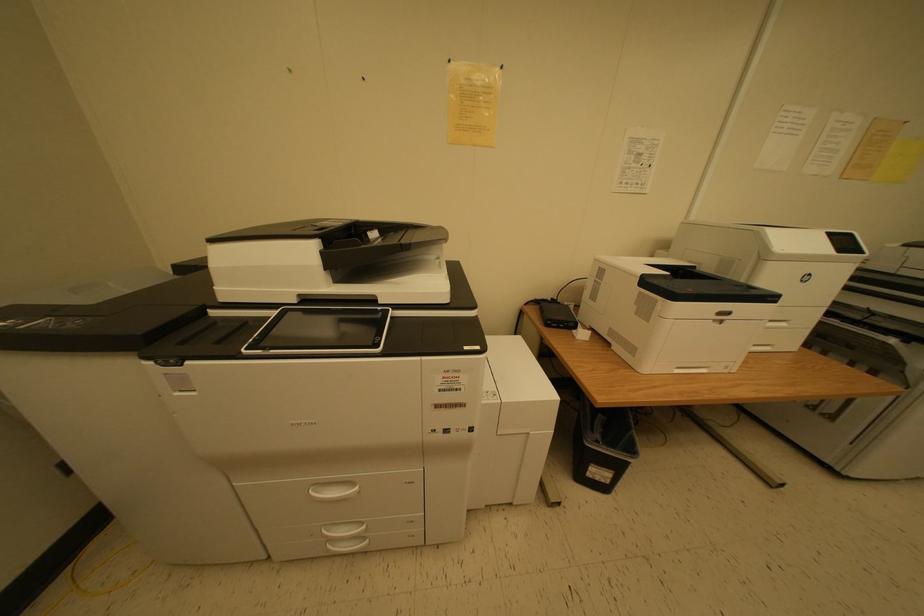
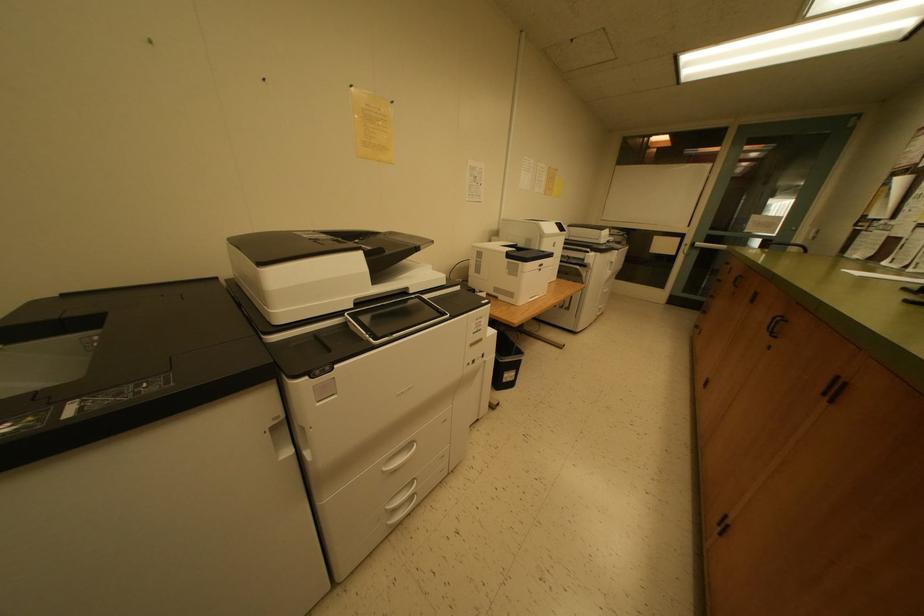
Question: Based on the continuous images, in which direction is the camera rotating? Reply with the corresponding letter.

Choices:
 (A) Left
 (B) Right
 (C) Up
 (D) Down

Answer: (B)